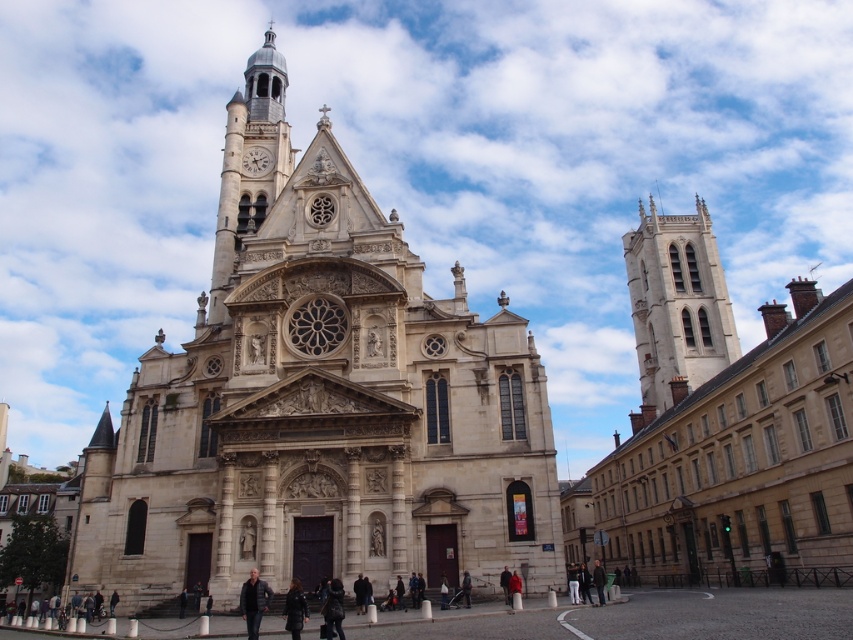
Who is lower down, leather jacket at lower center or red jacket at center?

red jacket at center is below.

Is point (299, 625) farther from camera compared to point (500, 573)?

No, (299, 625) is in front of (500, 573).

Is point (289, 627) more distant than point (508, 596)?

No.

Locate an element on the screen. This screenshot has height=640, width=853. leather jacket at lower center is located at coordinates coord(294,609).

Is point (650, 323) positioned before point (503, 593)?

No.

Which of these two, white stone tower at right or red jacket at center, stands shorter?

With less height is red jacket at center.

This screenshot has width=853, height=640. What do you see at coordinates (676, 305) in the screenshot? I see `white stone tower at right` at bounding box center [676, 305].

Identify the location of white stone tower at right. This screenshot has height=640, width=853. (676, 305).

Who is more distant from viewer, (x=335, y=593) or (x=308, y=612)?

The point (x=308, y=612) is more distant.

Looking at this image, can you confirm if dark brown leather jacket at center is taller than leather jacket at lower center?

Yes.

Who is more distant from viewer, (337, 618) or (300, 596)?

The point (300, 596) is behind.

Image resolution: width=853 pixels, height=640 pixels. I want to click on dark brown leather jacket at center, so click(x=334, y=611).